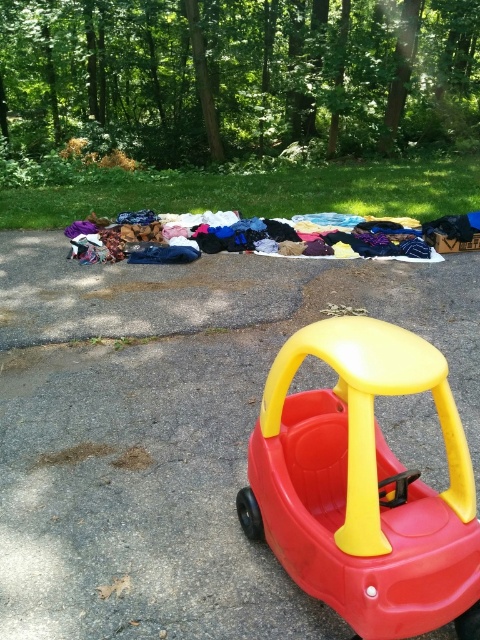
Question: Which point appears closest to the camera in this image?

Choices:
 (A) (216, 609)
 (B) (162, 234)

Answer: (A)

Question: Which object is closer to the camera taking this photo?

Choices:
 (A) matte plastic toy car at center
 (B) multicolored fabric at center
 (C) red plastic toy car at lower right

Answer: (A)

Question: Can you confirm if red plastic toy car at lower right is smaller than matte plastic toy car at center?

Choices:
 (A) no
 (B) yes

Answer: (A)

Question: Which point is farther from the camera taking this photo?

Choices:
 (A) (227, 280)
 (B) (420, 529)
 (C) (157, 230)

Answer: (C)

Question: Can you confirm if red plastic toy car at lower right is positioned to the right of multicolored fabric at center?

Choices:
 (A) yes
 (B) no

Answer: (A)

Question: Can you confirm if matte plastic toy car at center is positioned to the right of multicolored fabric at center?

Choices:
 (A) no
 (B) yes

Answer: (B)